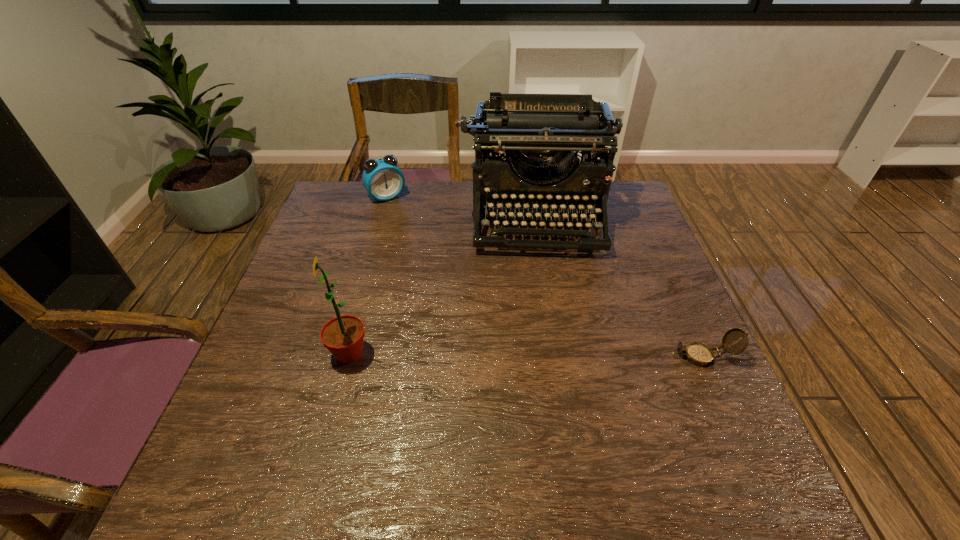
Locate an element on the screen. The width and height of the screenshot is (960, 540). vacant space that satisfies the following two spatial constraints: 1. on the front side of the shortest object; 2. on the face of the typewriter is located at coordinates (561, 356).

I want to click on vacant space that satisfies the following two spatial constraints: 1. on the front side of the second shortest object; 2. on the right side of the typewriter, so click(381, 215).